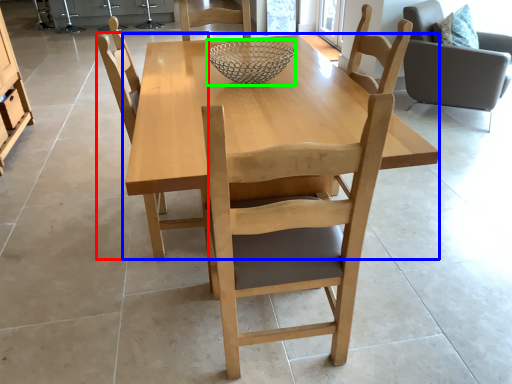
Question: Which object is the farthest from chair (highlighted by a red box)? Choose among these: kitchen & dining room table (highlighted by a blue box) or glass bowl (highlighted by a green box).

Choices:
 (A) kitchen & dining room table
 (B) glass bowl

Answer: (B)